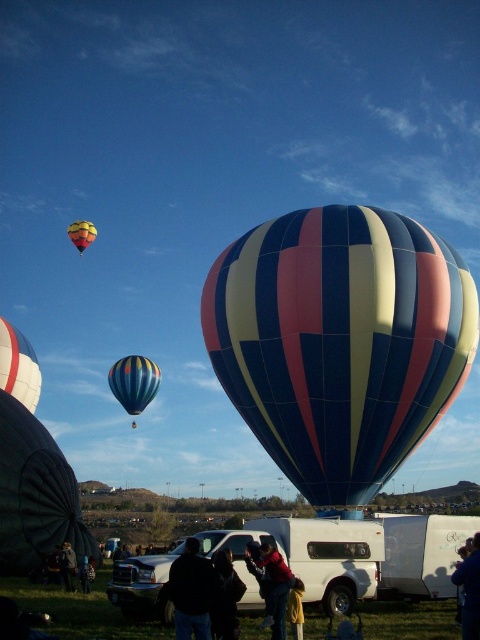
Can you confirm if white glossy balloon at left is positioned to the right of dark blue jacket at lower left?

Incorrect, white glossy balloon at left is not on the right side of dark blue jacket at lower left.

Is white glossy balloon at left below dark blue jacket at lower left?

Actually, white glossy balloon at left is above dark blue jacket at lower left.

Who is more distant from viewer, (21, 362) or (86, 564)?

Positioned behind is point (21, 362).

The height and width of the screenshot is (640, 480). Identify the location of white glossy balloon at left. (19, 365).

Does matte black balloon at lower left appear on the left side of black fabric jacket at center?

Indeed, matte black balloon at lower left is positioned on the left side of black fabric jacket at center.

Who is more distant from viewer, (2, 438) or (208, 563)?

The point (2, 438) is more distant.

Identify the location of matte black balloon at lower left. (35, 493).

Is dark blue jeans at lower center above dark blue jacket at lower left?

Yes.

I want to click on dark blue jeans at lower center, so click(296, 609).

Does point (292, 628) come in front of point (79, 568)?

Yes, point (292, 628) is in front of point (79, 568).

Find the location of a particular element. This screenshot has height=640, width=480. dark blue jeans at lower center is located at coordinates [x=296, y=609].